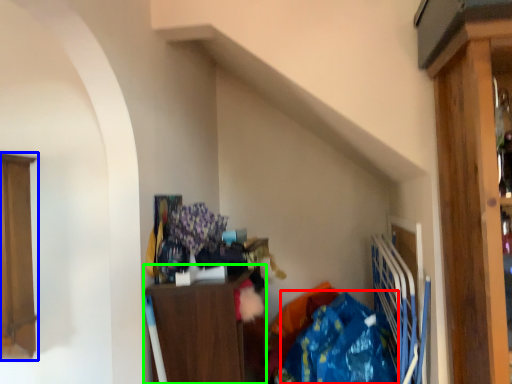
Question: Which object is the closest to the clothing (highlighted by a red box)? Choose among these: cabinetry (highlighted by a blue box) or cabinetry (highlighted by a green box).

Choices:
 (A) cabinetry
 (B) cabinetry

Answer: (B)